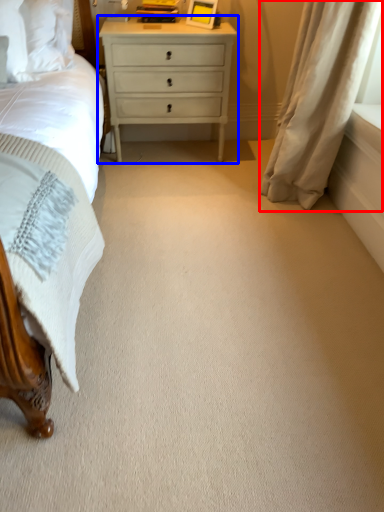
Question: Which object appears farthest to the camera in this image, curtain (highlighted by a red box) or nightstand (highlighted by a blue box)?

Choices:
 (A) curtain
 (B) nightstand

Answer: (B)